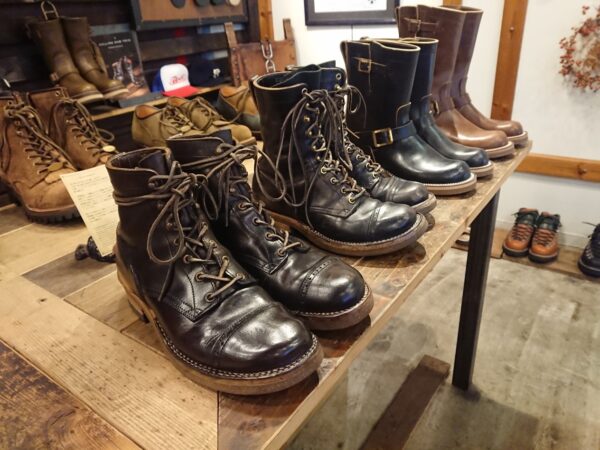
Locate an element on the screen. wall is located at coordinates (343, 36), (551, 108).